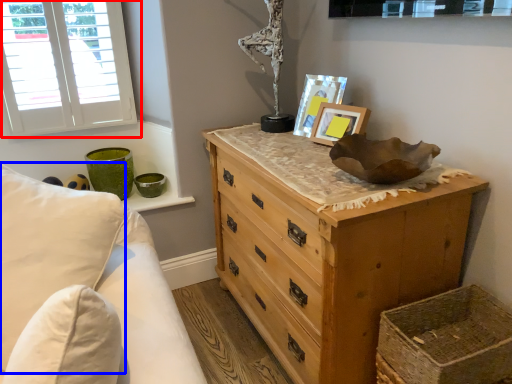
Question: Which point is closer to the camera, window (highlighted by a red box) or pillow (highlighted by a blue box)?

Choices:
 (A) window
 (B) pillow

Answer: (B)